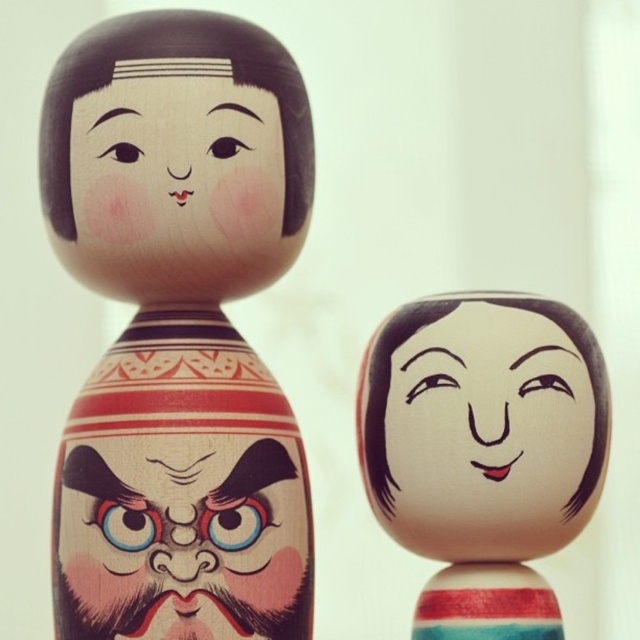
Is wooden painted mask at center positioned at the back of smooth wood face at center?

That is False.

Is wooden painted mask at center above smooth wood face at center?

No.

What are the coordinates of `wooden painted mask at center` in the screenshot? It's located at (184, 540).

This screenshot has height=640, width=640. I want to click on wooden painted mask at center, so click(184, 540).

Does point (538, 524) come closer to viewer compared to point (253, 216)?

No, it is behind (253, 216).

Based on the photo, who is shorter, smooth beige face at center or smooth wood face at center?

Standing shorter between the two is smooth wood face at center.

Image resolution: width=640 pixels, height=640 pixels. Describe the element at coordinates (492, 419) in the screenshot. I see `smooth beige face at center` at that location.

Where is `smooth beige face at center`? Image resolution: width=640 pixels, height=640 pixels. smooth beige face at center is located at coordinates (492, 419).

Describe the element at coordinates (177, 170) in the screenshot. The width and height of the screenshot is (640, 640). I see `wooden doll at center` at that location.

Does wooden doll at center have a larger size compared to wooden painted mask at center?

Yes, wooden doll at center is bigger than wooden painted mask at center.

Find the location of `wooden doll at center`. wooden doll at center is located at coordinates (177, 170).

This screenshot has width=640, height=640. I want to click on wooden doll at center, so click(177, 170).